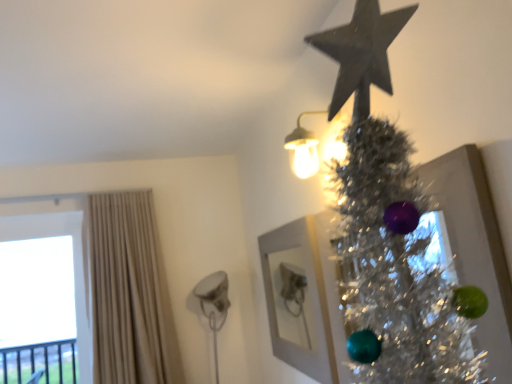
Question: Is beige fabric curtain at left positioned beyond the bounds of shiny silver tinsel at upper right?

Choices:
 (A) yes
 (B) no

Answer: (A)

Question: Could you tell me if beige fabric curtain at left is facing shiny silver tinsel at upper right?

Choices:
 (A) yes
 (B) no

Answer: (B)

Question: Can you confirm if beige fabric curtain at left is bigger than shiny silver tinsel at upper right?

Choices:
 (A) yes
 (B) no

Answer: (A)

Question: From the image's perspective, is beige fabric curtain at left under shiny silver tinsel at upper right?

Choices:
 (A) yes
 (B) no

Answer: (A)

Question: From a real-world perspective, is beige fabric curtain at left physically below shiny silver tinsel at upper right?

Choices:
 (A) no
 (B) yes

Answer: (A)

Question: From the image's perspective, is transparent glass window at left above or below beige fabric curtain at left?

Choices:
 (A) below
 (B) above

Answer: (A)

Question: In terms of height, does transparent glass window at left look taller or shorter compared to beige fabric curtain at left?

Choices:
 (A) short
 (B) tall

Answer: (A)

Question: Visually, is transparent glass window at left positioned to the left or to the right of beige fabric curtain at left?

Choices:
 (A) right
 (B) left

Answer: (B)

Question: Considering their positions, is transparent glass window at left located in front of or behind beige fabric curtain at left?

Choices:
 (A) behind
 (B) front

Answer: (A)

Question: Looking at their shapes, would you say white matte picture frame at upper center is wider or thinner than shiny silver tinsel at upper right?

Choices:
 (A) thin
 (B) wide

Answer: (A)

Question: From the image's perspective, is white matte picture frame at upper center positioned above or below shiny silver tinsel at upper right?

Choices:
 (A) above
 (B) below

Answer: (B)

Question: Considering the relative positions of white matte picture frame at upper center and shiny silver tinsel at upper right in the image provided, is white matte picture frame at upper center to the left or to the right of shiny silver tinsel at upper right?

Choices:
 (A) left
 (B) right

Answer: (A)

Question: Which is correct: white matte picture frame at upper center is inside shiny silver tinsel at upper right, or outside of it?

Choices:
 (A) outside
 (B) inside

Answer: (A)

Question: From a real-world perspective, relative to matte white sconce at upper right, is shiny silver tinsel at upper right vertically above or below?

Choices:
 (A) above
 (B) below

Answer: (B)

Question: Considering their positions, is shiny silver tinsel at upper right located in front of or behind matte white sconce at upper right?

Choices:
 (A) front
 (B) behind

Answer: (A)